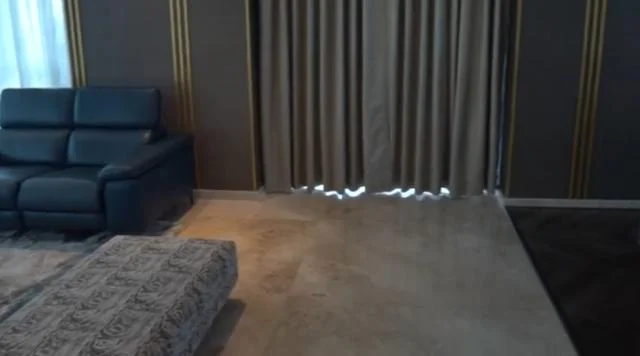
Locate an element on the screen. space above couch is located at coordinates (125, 53).